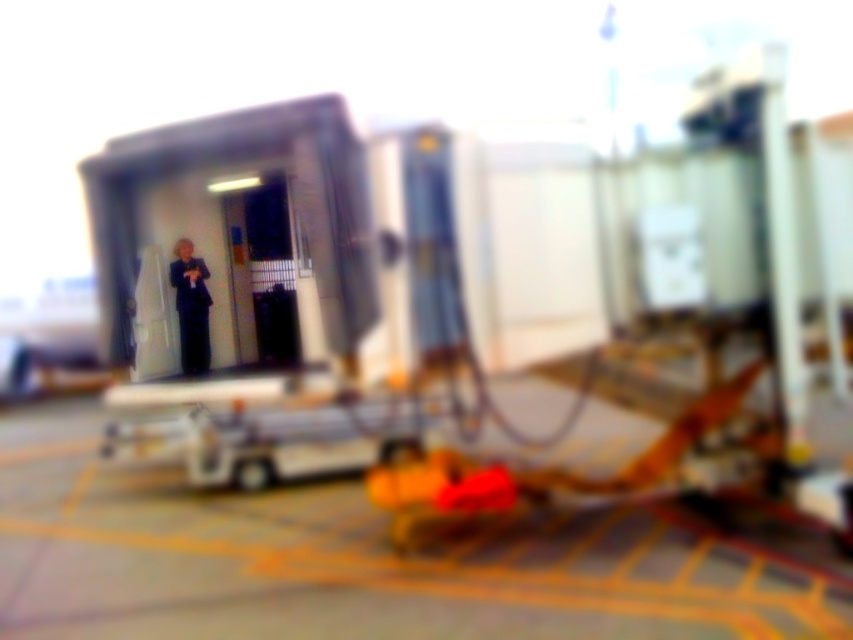
Question: Which point appears farthest from the camera in this image?

Choices:
 (A) (148, 595)
 (B) (201, 372)

Answer: (B)

Question: Is yellow rubber mat at lower center thinner than dark blue suit at center?

Choices:
 (A) no
 (B) yes

Answer: (A)

Question: Does yellow rubber mat at lower center have a lesser width compared to dark blue suit at center?

Choices:
 (A) yes
 (B) no

Answer: (B)

Question: Does yellow rubber mat at lower center have a smaller size compared to dark blue suit at center?

Choices:
 (A) yes
 (B) no

Answer: (B)

Question: Which point is closer to the camera?

Choices:
 (A) (190, 259)
 (B) (0, 488)

Answer: (A)